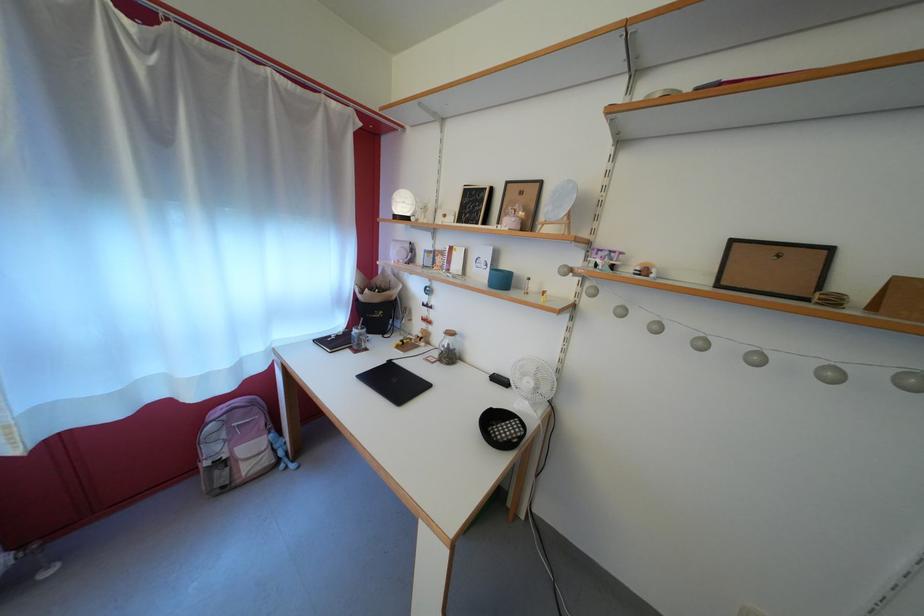
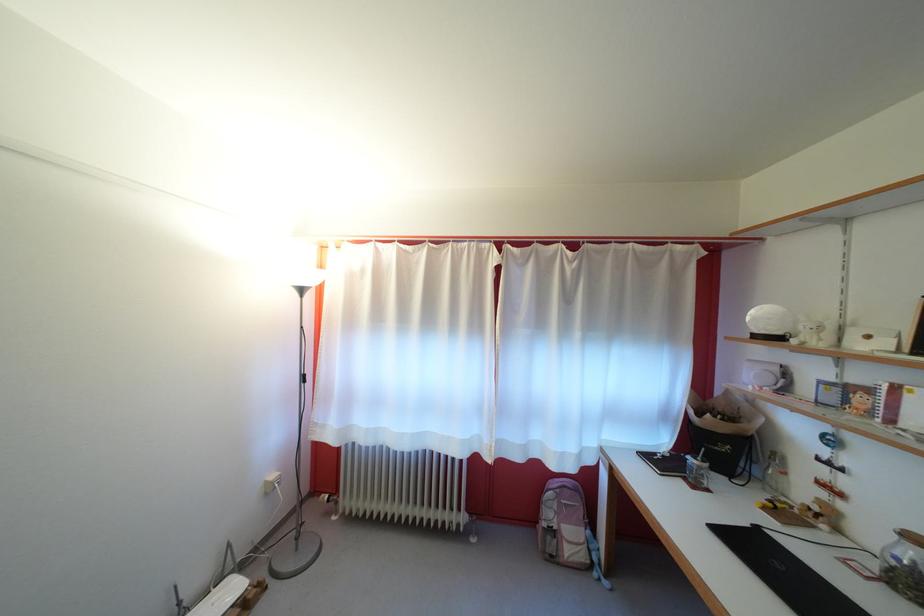
Locate, in the second image, the point that corresponds to pixel 444 361 in the first image.

(881, 570)